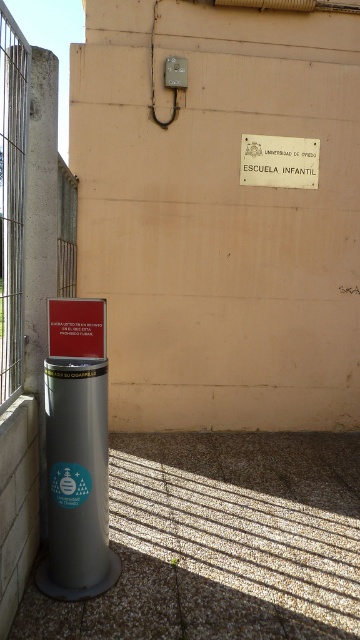
Question: Does concrete fence at left appear under metallic sign at center?

Choices:
 (A) yes
 (B) no

Answer: (B)

Question: Does concrete fence at left appear on the left side of metallic sign at center?

Choices:
 (A) no
 (B) yes

Answer: (B)

Question: Which object is the closest to the white matte sign at upper center?

Choices:
 (A) metallic sign at center
 (B) concrete fence at left

Answer: (B)

Question: Does concrete fence at left have a larger size compared to white matte sign at upper center?

Choices:
 (A) yes
 (B) no

Answer: (A)

Question: Among these points, which one is farthest from the camera?

Choices:
 (A) (50, 336)
 (B) (258, 184)
 (C) (23, 106)

Answer: (B)

Question: Which of the following is the closest to the observer?

Choices:
 (A) (72, 294)
 (B) (248, 157)

Answer: (A)